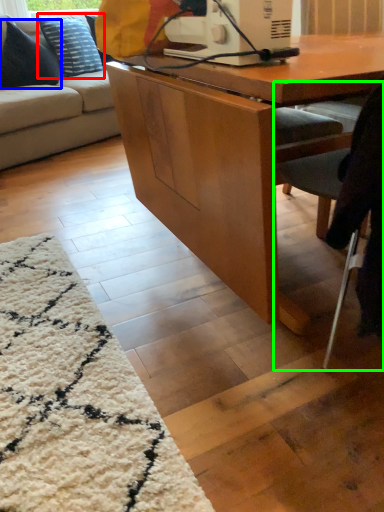
Question: Based on their relative distances, which object is nearer to pillow (highlighted by a red box)? Choose from pillow (highlighted by a blue box) and chair (highlighted by a green box).

Choices:
 (A) pillow
 (B) chair

Answer: (A)